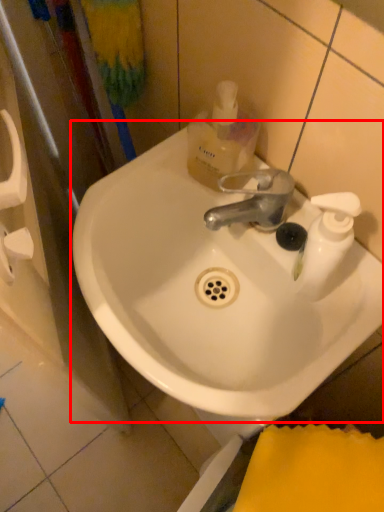
Question: From the image, what is the correct spatial relationship of sink (annotated by the red box) in relation to mouthwash?

Choices:
 (A) left
 (B) right

Answer: (A)